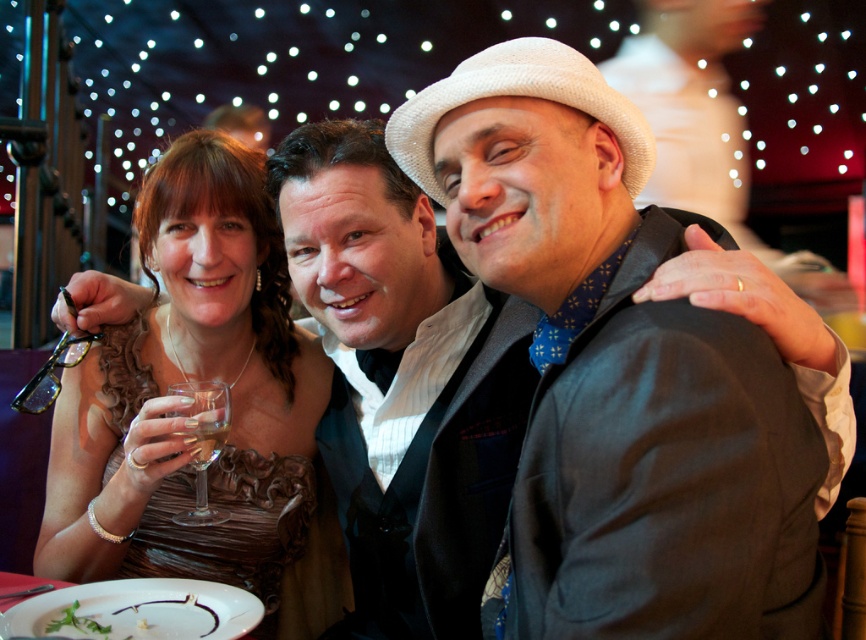
You are standing in the restaurant and want to reach the point marked as point (638, 560). If your arm is 26 inches long, can you reach it without moving your feet?

The point (638, 560) is 27.00 inches away from viewer. Since your arm is 26 inches long, you cannot reach it without moving your feet.

You are a photographer at this event and need to adjust the lighting so that both the matte black jacket at center and the brown satin dress at left are well illuminated. Which object should you focus on first to ensure proper exposure?

The matte black jacket at center should be focused on first because it is in front of the brown satin dress at left, meaning it will be closer to the camera and require adjustment for proper exposure.

You are standing at the entrance of the restaurant and want to locate the matte black jacket at center. Based on the coordinates provided, where should you look relative to the image frame?

The matte black jacket at center is located at the coordinates 0.584 on the x axis and 0.712 on the y axis within the image frame.